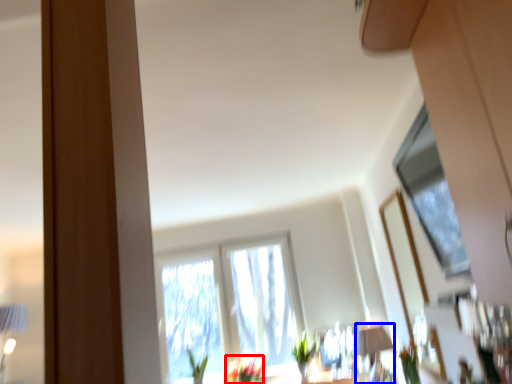
Question: Which of the following is the closest to the observer, flower (highlighted by a red box) or table lamp (highlighted by a blue box)?

Choices:
 (A) flower
 (B) table lamp

Answer: (B)